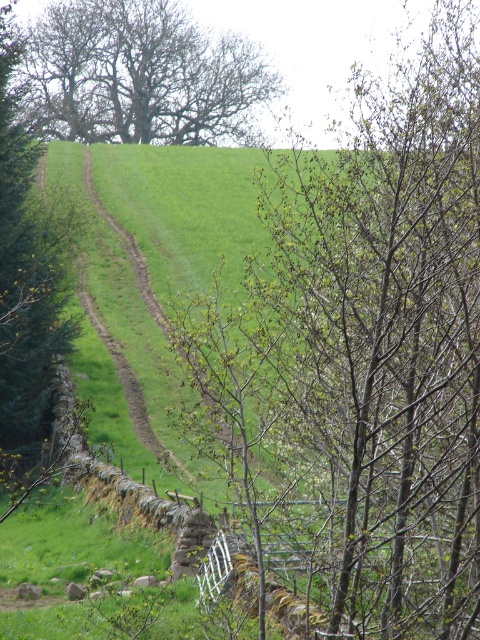
Question: Does brown textured tree at upper left have a lesser width compared to green leafy tree at upper left?

Choices:
 (A) yes
 (B) no

Answer: (B)

Question: Which of the following is the closest to the observer?

Choices:
 (A) (25, 132)
 (B) (127, 67)

Answer: (A)

Question: Does green leafy tree at center have a lesser width compared to brown textured tree at upper left?

Choices:
 (A) yes
 (B) no

Answer: (A)

Question: Where is brown textured tree at upper left located in relation to green leafy tree at upper left in the image?

Choices:
 (A) right
 (B) left

Answer: (B)

Question: Which of the following is the farthest from the observer?

Choices:
 (A) (382, 234)
 (B) (12, 42)

Answer: (B)

Question: Which point is closer to the camera?

Choices:
 (A) brown textured tree at upper left
 (B) green leafy tree at center

Answer: (B)